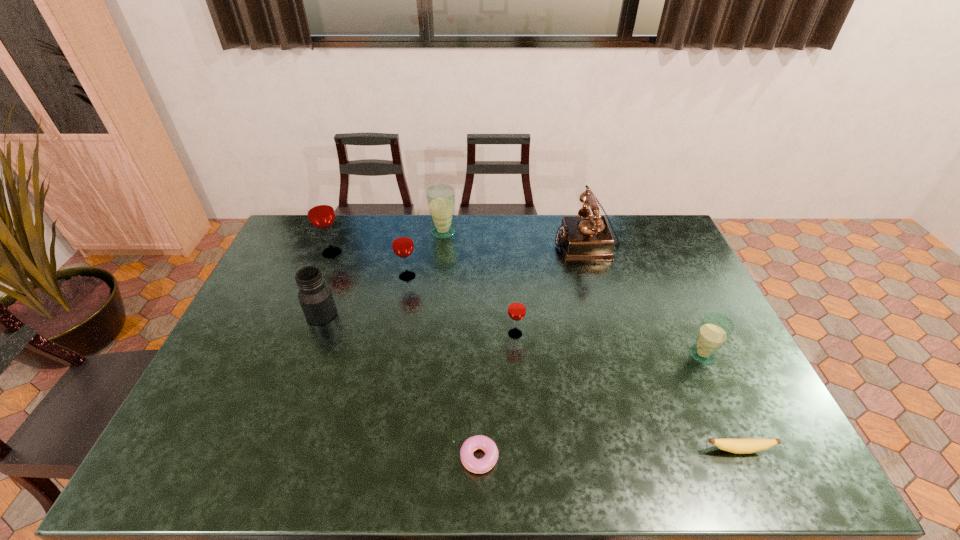
You are a GUI agent. You are given a task and a screenshot of the screen. Output one action in this format:
    pyautogui.click(x=<x>, y=<y>)
    Task: Click on the biggest red glass
    
    Given the screenshot: What is the action you would take?
    pyautogui.click(x=320, y=211)

You are a GUI agent. You are given a task and a screenshot of the screen. Output one action in this format:
    pyautogui.click(x=<x>, y=<y>)
    Task: Click on the farthest red glass
    
    Given the screenshot: What is the action you would take?
    pyautogui.click(x=320, y=211)

You are a GUI agent. You are given a task and a screenshot of the screen. Output one action in this format:
    pyautogui.click(x=<x>, y=<y>)
    Task: Click on the seventh object from left to right
    The height and width of the screenshot is (540, 960).
    Given the screenshot: What is the action you would take?
    pyautogui.click(x=584, y=238)

Locate an element on the screen. Image resolution: width=960 pixels, height=540 pixels. brown telephone is located at coordinates (584, 238).

Locate an element on the screen. the third nearest glass is located at coordinates pos(402,242).

This screenshot has height=540, width=960. I want to click on the second red glass from left to right, so click(402, 242).

The width and height of the screenshot is (960, 540). Identify the location of the bigger blue glass. (440, 198).

The height and width of the screenshot is (540, 960). What are the coordinates of `the farther blue glass` in the screenshot? It's located at (440, 198).

Where is `jar`? The height and width of the screenshot is (540, 960). jar is located at coordinates (315, 296).

Where is `the seventh farthest object`? the seventh farthest object is located at coordinates (715, 329).